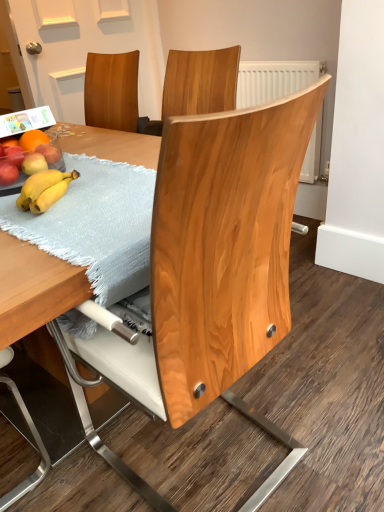
Find the location of a particular element. The height and width of the screenshot is (512, 384). free location to the right of matte red apple at left, the fourth apple when ordered from front to back is located at coordinates (99, 164).